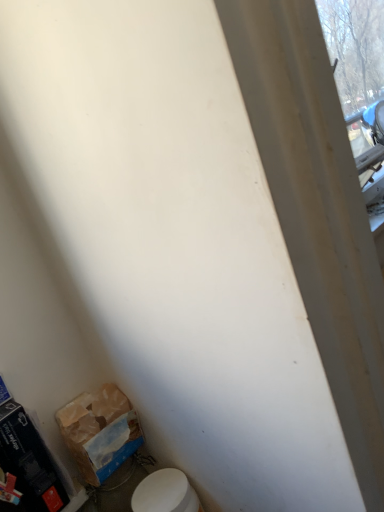
This screenshot has height=512, width=384. In order to click on brown paper bag at lower left in this screenshot , I will do `click(100, 432)`.

Measure the distance between point [107,467] and camera.

The distance of point [107,467] from camera is 33.50 inches.

Describe the element at coordinates (100, 432) in the screenshot. This screenshot has height=512, width=384. I see `brown paper bag at lower left` at that location.

What is the approximate width of brown paper bag at lower left?

brown paper bag at lower left is 4.81 inches in width.

Find the location of a particular element. Image resolution: width=384 pixels, height=512 pixels. brown paper bag at lower left is located at coordinates (100, 432).